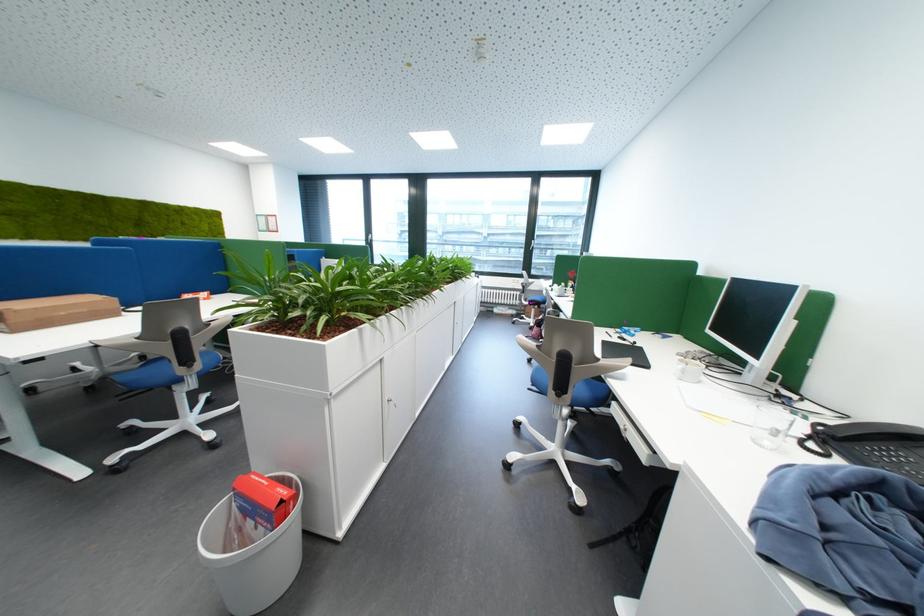
You are a GUI agent. You are given a task and a screenshot of the screen. Output one action in this format:
    pyautogui.click(x=<x>, y=<y>)
    Task: Click on the clear drinking glass
    The image size is (924, 616).
    Given the screenshot: What is the action you would take?
    pyautogui.click(x=771, y=426)